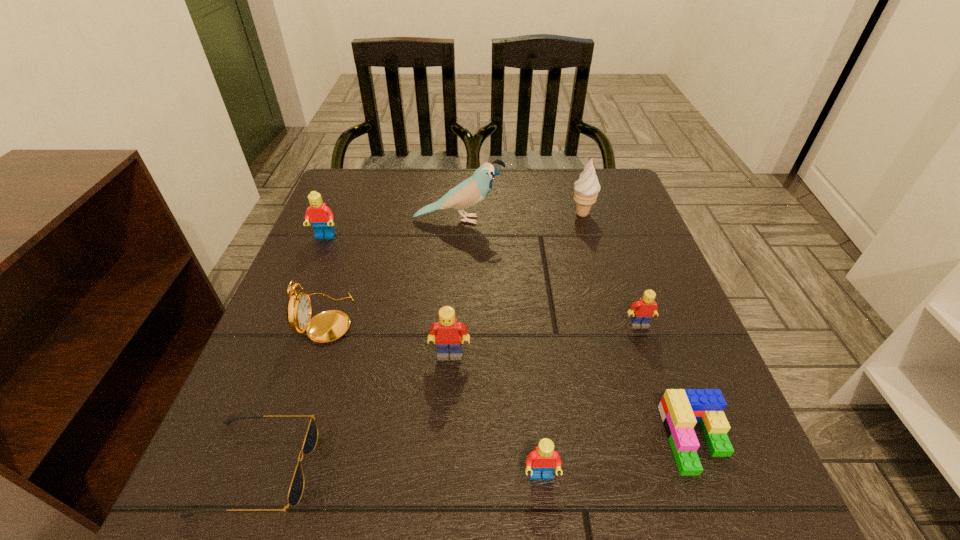
Choose which Lego is the fourth nearest neighbor to the smaller red Lego. Please provide its 2D coordinates. Your answer should be formatted as a tuple, i.e. [(x, y)], where the tuple contains the x and y coordinates of a point satisfying the conditions above.

[(321, 217)]

Image resolution: width=960 pixels, height=540 pixels. Identify the location of vacant region that satisfies the following two spatial constraints: 1. on the front-facing side of the second farthest Lego; 2. on the front-facing side of the sunglasses. (688, 468).

I want to click on free point that satisfies the following two spatial constraints: 1. at the face of the blue bird; 2. on the face of the leftmost Lego, so (458, 237).

The width and height of the screenshot is (960, 540). I want to click on free region that satisfies the following two spatial constraints: 1. on the front-facing side of the third farthest Lego; 2. on the left side of the green Lego, so click(x=444, y=439).